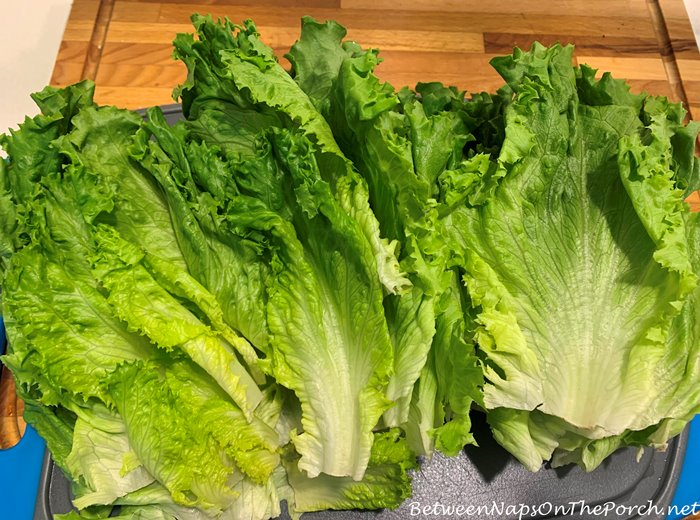
The image size is (700, 520). I want to click on cutting board, so click(x=145, y=71).